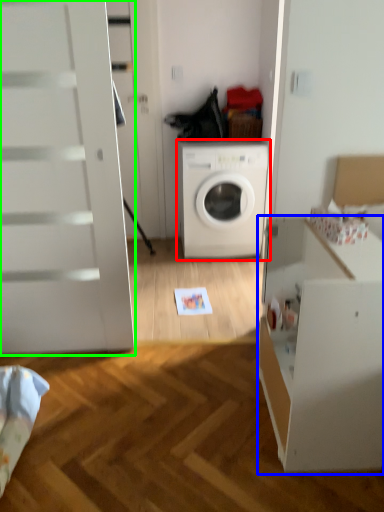
Question: Considering the real-world distances, which object is farthest from washing machine (highlighted by a red box)? file cabinet (highlighted by a blue box) or screen door (highlighted by a green box)?

Choices:
 (A) file cabinet
 (B) screen door

Answer: (A)